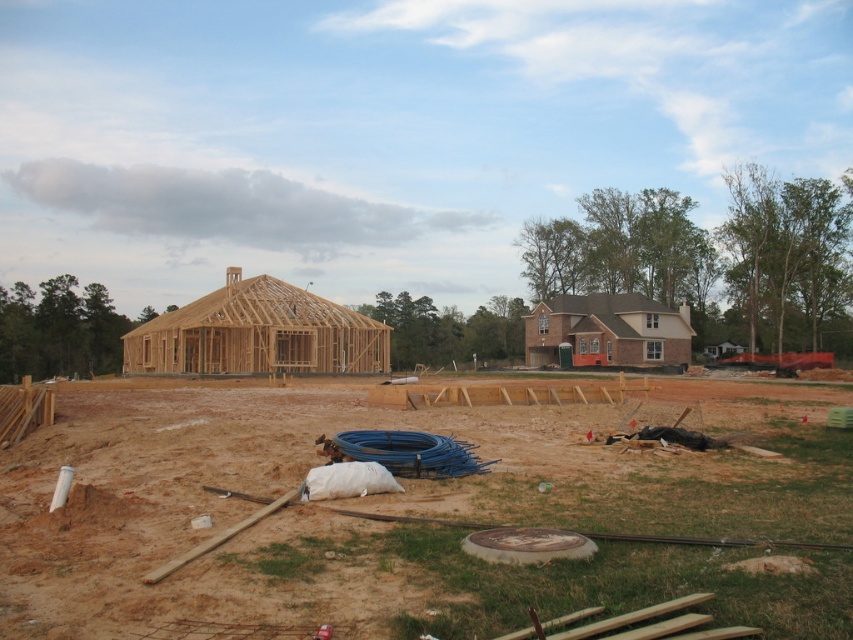
Question: Among these objects, which one is farthest from the camera?

Choices:
 (A) wooden frame house at center
 (B) brown wooden construction site at center
 (C) brown brick house at center-right

Answer: (C)

Question: Considering the relative positions of wooden frame house at center and brown brick house at center-right in the image provided, where is wooden frame house at center located with respect to brown brick house at center-right?

Choices:
 (A) right
 (B) left

Answer: (B)

Question: Which point appears farthest from the camera in this image?

Choices:
 (A) (125, 536)
 (B) (299, 323)

Answer: (B)

Question: Is wooden frame house at center to the right of brown brick house at center-right from the viewer's perspective?

Choices:
 (A) no
 (B) yes

Answer: (A)

Question: Which point is farther from the camera taking this photo?

Choices:
 (A) (372, 326)
 (B) (688, 323)

Answer: (B)

Question: Does brown wooden construction site at center have a smaller size compared to wooden frame house at center?

Choices:
 (A) yes
 (B) no

Answer: (A)